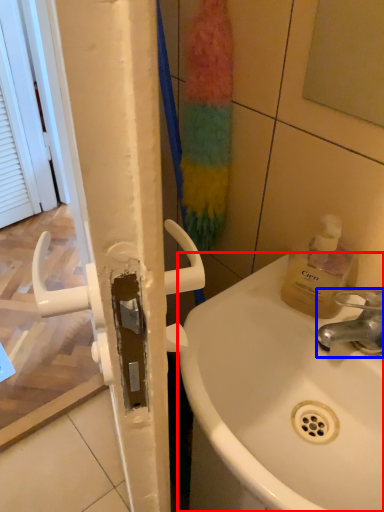
Question: Which object appears closest to the camera in this image, sink (highlighted by a red box) or tap (highlighted by a blue box)?

Choices:
 (A) sink
 (B) tap

Answer: (A)